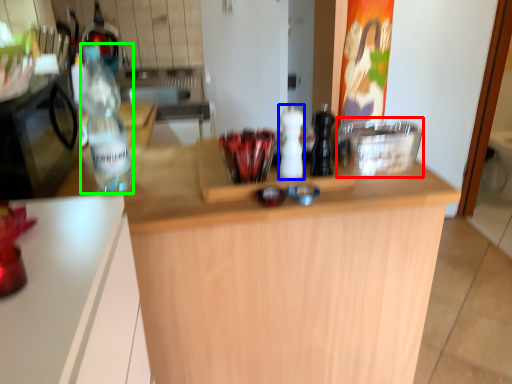
Question: Based on their relative distances, which object is nearer to appliance (highlighted by a red box)? Choose from bottle (highlighted by a blue box) and bottle (highlighted by a green box).

Choices:
 (A) bottle
 (B) bottle

Answer: (A)